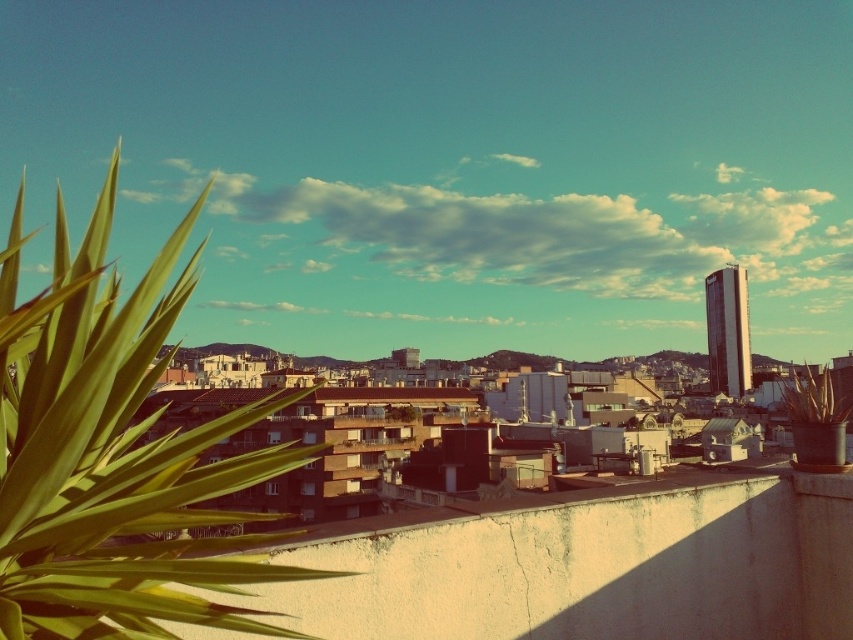
You are a drone operator who needs to fly a drone between the green leafy plant at left and the green leafy plant at upper left. The drone has a maximum flight distance of 100 meters. Can the drone successfully complete the flight between these two plants?

The distance between the green leafy plant at left and the green leafy plant at upper left is 101.79 meters, which exceeds the drone operator maximum flight distance of 100 meters. The drone cannot successfully complete the flight between these two plants.

You are a photographer wanting to capture both the green leafy plant at left and the green leafy plant at upper left in a single frame. Based on their positions, which plant should you adjust your camera to focus on first to ensure both are in the shot?

The green leafy plant at left is to the left of green leafy plant at upper left, so you should focus on the green leafy plant at left first to ensure both are included in the frame.